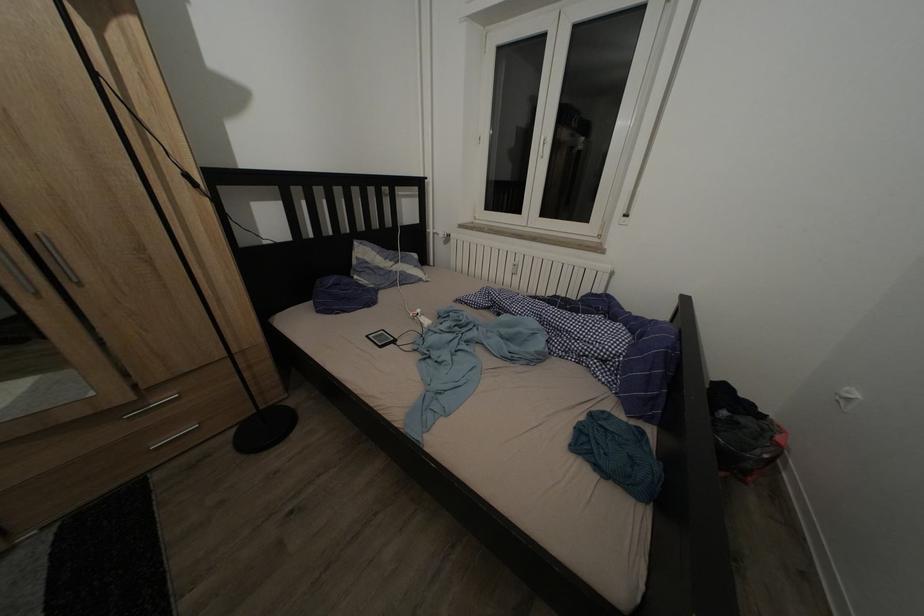
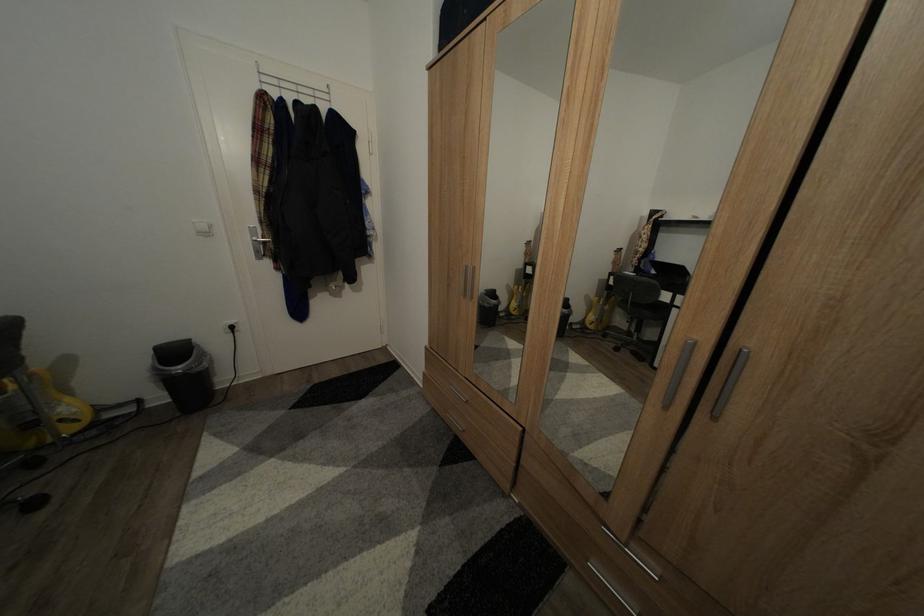
First-person continuous shooting, in which direction is the camera rotating?

The camera's rotation is toward left-down.